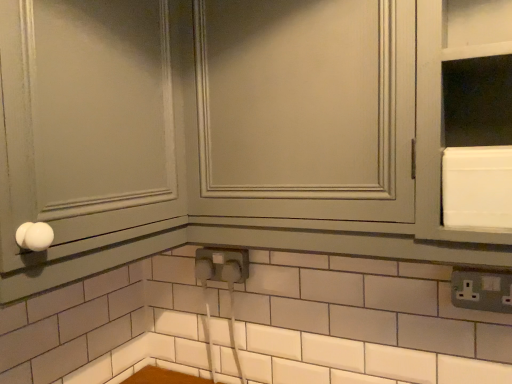
Question: Can you confirm if gray plastic electrical outlet at lower right is shorter than white glossy knob at left?

Choices:
 (A) yes
 (B) no

Answer: (A)

Question: Does gray plastic electrical outlet at lower right have a greater width compared to white glossy knob at left?

Choices:
 (A) no
 (B) yes

Answer: (A)

Question: Is gray plastic electrical outlet at lower right further to camera compared to white glossy knob at left?

Choices:
 (A) yes
 (B) no

Answer: (A)

Question: Does gray plastic electrical outlet at lower right appear on the left side of white glossy knob at left?

Choices:
 (A) yes
 (B) no

Answer: (B)

Question: Is gray plastic electrical outlet at lower right positioned with its back to white glossy knob at left?

Choices:
 (A) no
 (B) yes

Answer: (A)

Question: Considering the positions of gray plastic electrical outlet at lower right and white glossy cabinet at center in the image, is gray plastic electrical outlet at lower right wider or thinner than white glossy cabinet at center?

Choices:
 (A) wide
 (B) thin

Answer: (B)

Question: Is gray plastic electrical outlet at lower right bigger or smaller than white glossy cabinet at center?

Choices:
 (A) big
 (B) small

Answer: (B)

Question: Relative to white glossy cabinet at center, is gray plastic electrical outlet at lower right in front or behind?

Choices:
 (A) front
 (B) behind

Answer: (B)

Question: From a real-world perspective, is gray plastic electrical outlet at lower right physically located above or below white glossy cabinet at center?

Choices:
 (A) above
 (B) below

Answer: (B)

Question: Visually, is white glossy cabinet at center positioned to the left or to the right of gray plastic electrical outlet at lower right?

Choices:
 (A) right
 (B) left

Answer: (B)

Question: Looking at the image, does white glossy cabinet at center seem bigger or smaller compared to gray plastic electrical outlet at lower right?

Choices:
 (A) small
 (B) big

Answer: (B)

Question: Choose the correct answer: Is white glossy cabinet at center inside gray plastic electrical outlet at lower right or outside it?

Choices:
 (A) outside
 (B) inside

Answer: (A)

Question: Considering the positions of white glossy cabinet at center and gray plastic electrical outlet at lower right in the image, is white glossy cabinet at center taller or shorter than gray plastic electrical outlet at lower right?

Choices:
 (A) tall
 (B) short

Answer: (A)

Question: In terms of width, does white glossy cabinet at center look wider or thinner when compared to white glossy knob at left?

Choices:
 (A) thin
 (B) wide

Answer: (A)

Question: From a real-world perspective, is white glossy cabinet at center positioned above or below white glossy knob at left?

Choices:
 (A) above
 (B) below

Answer: (B)